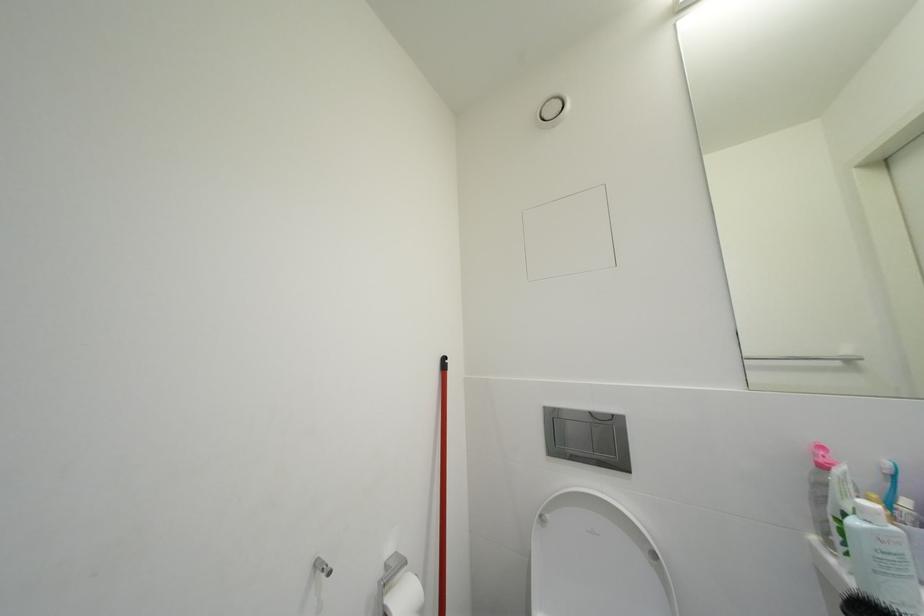
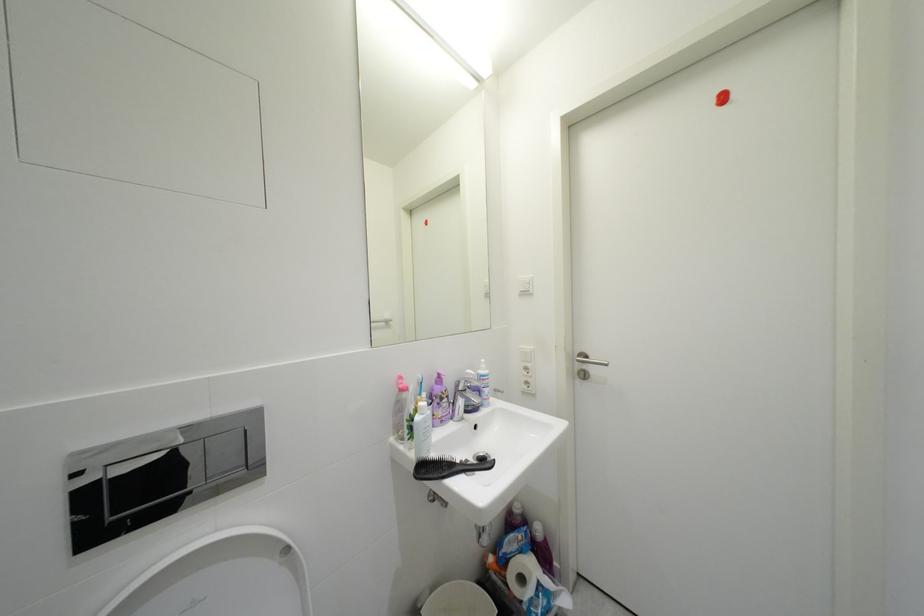
Question: Based on the continuous images, in which direction is the camera rotating? Reply with the corresponding letter.

Choices:
 (A) Left
 (B) Right
 (C) Up
 (D) Down

Answer: (B)